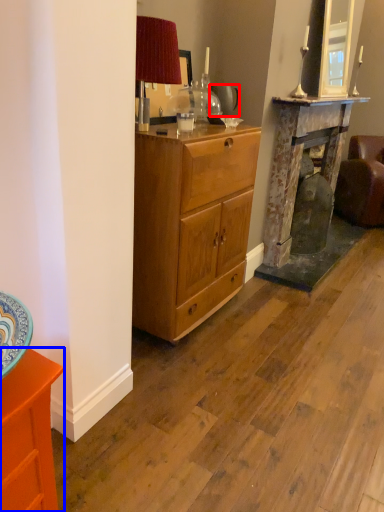
Question: Among these objects, which one is nearest to the camera, teapot (highlighted by a red box) or cabinetry (highlighted by a blue box)?

Choices:
 (A) teapot
 (B) cabinetry

Answer: (B)